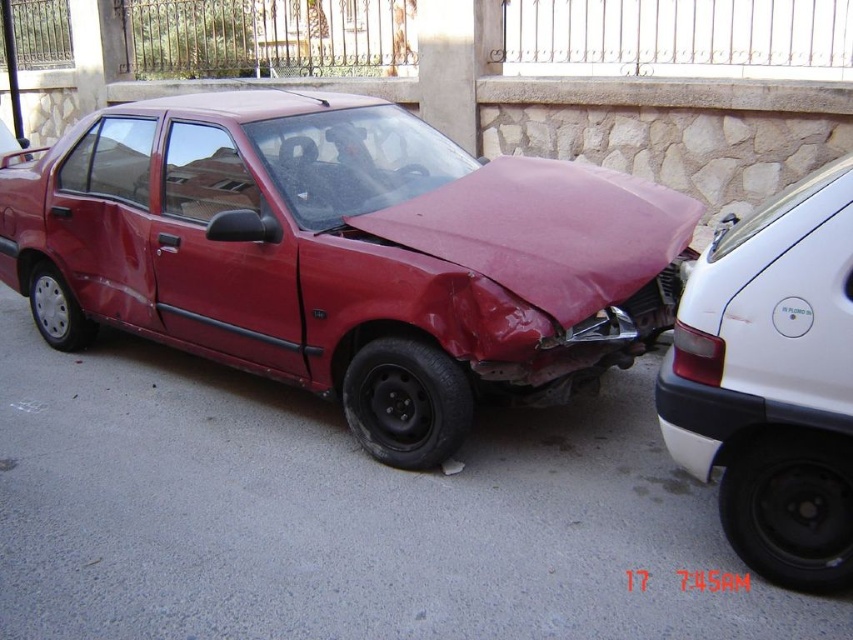
You are standing at the point with coordinates point (796, 310) and want to walk to the point with coordinates point (495, 228). Which direction should you face to move towards the destination?

You should face towards the direction opposite of point (796, 310) because point (495, 228) is behind point (796, 310).

You are a traffic officer assessing the scene of an accident. There is a matte red car at center. Based on its position, can you determine if it was the vehicle that collided with the other car?

The matte red car at center is located at point [343,253], which might indicate its position relative to other vehicles, but without additional information about the other vehicle positions or the direction of travel, it is impossible to definitively determine if it was involved in the collision.